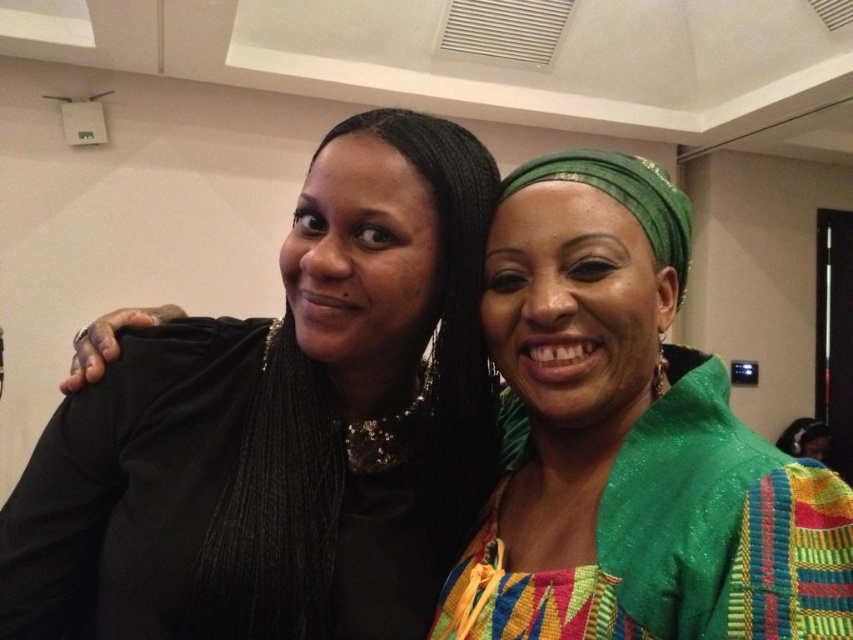
You are a photographer at the event and want to capture a photo where the black velvet sweater at left and the green woven fabric at center are both visible. Which object should you focus on first to ensure both are in frame?

The black velvet sweater at left is positioned under the green woven fabric at center, so you should focus on the green woven fabric at center first to ensure both are visible in the photo.